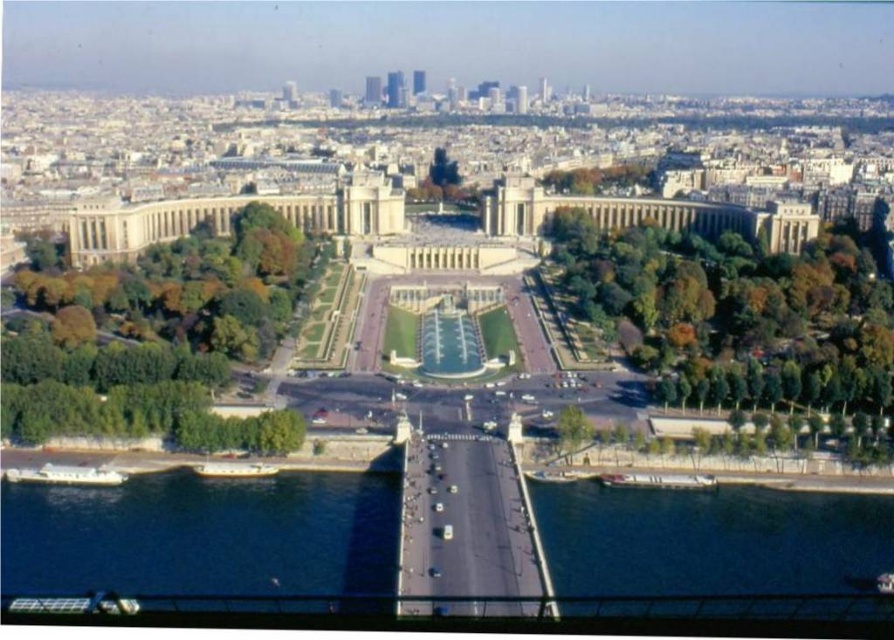
Who is shorter, blue glassy water at lower left or green glass water at center?

Standing shorter between the two is blue glassy water at lower left.

Which of these two, blue glassy water at lower left or green glass water at center, stands taller?

With more height is green glass water at center.

Between point (191, 515) and point (473, 317), which one is positioned behind?

The point (473, 317) is behind.

Where is `blue glassy water at lower left`? Image resolution: width=894 pixels, height=640 pixels. blue glassy water at lower left is located at coordinates (201, 536).

Is blue glassy water at lower left positioned before dark blue water at lower right?

No, it is not.

Who is more distant from viewer, [133,545] or [796,493]?

Point [796,493]

Is point (281, 580) less distant than point (723, 490)?

Yes.

Find the location of a particular element. The image size is (894, 640). blue glassy water at lower left is located at coordinates (201, 536).

Between dark blue water at lower right and green glass water at center, which one is positioned higher?

green glass water at center is above.

Is point (654, 538) less distant than point (443, 324)?

Yes, it is in front of point (443, 324).

Identify the location of dark blue water at lower right. Image resolution: width=894 pixels, height=640 pixels. (714, 541).